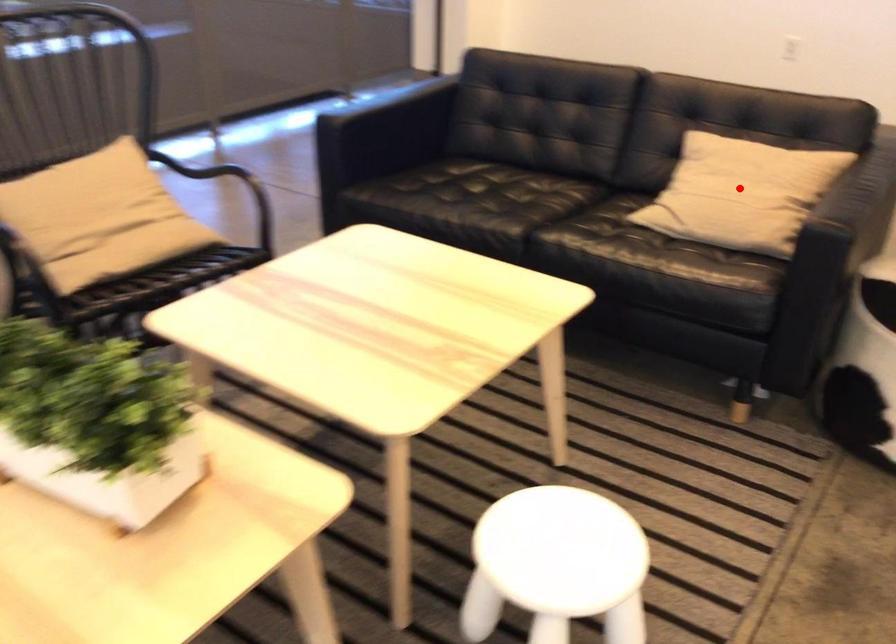
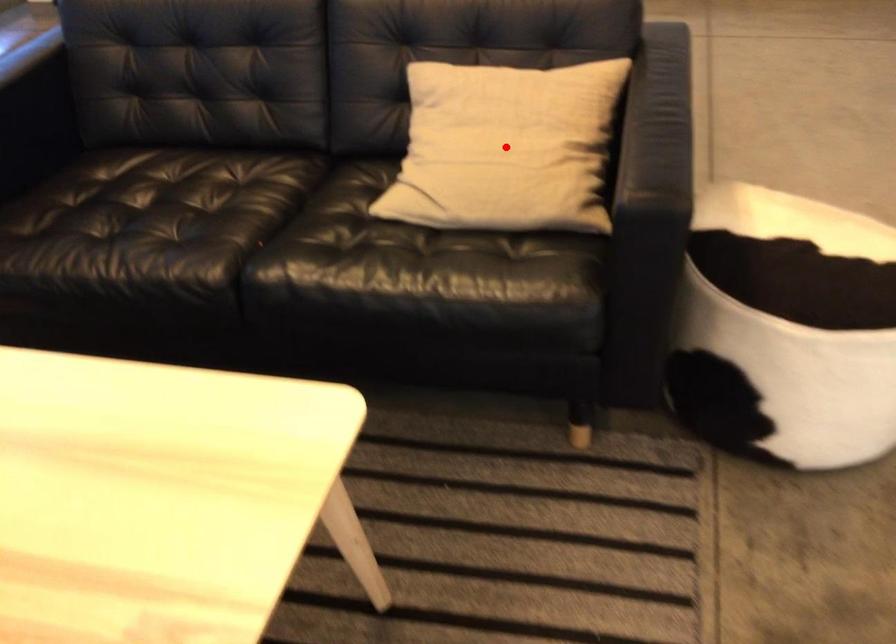
I am providing you with two images of the same scene from different viewpoints. A red point is marked on the first image and another point is marked on the second image. Are the points marked in image1 and image2 representing the same 3D position?

Yes